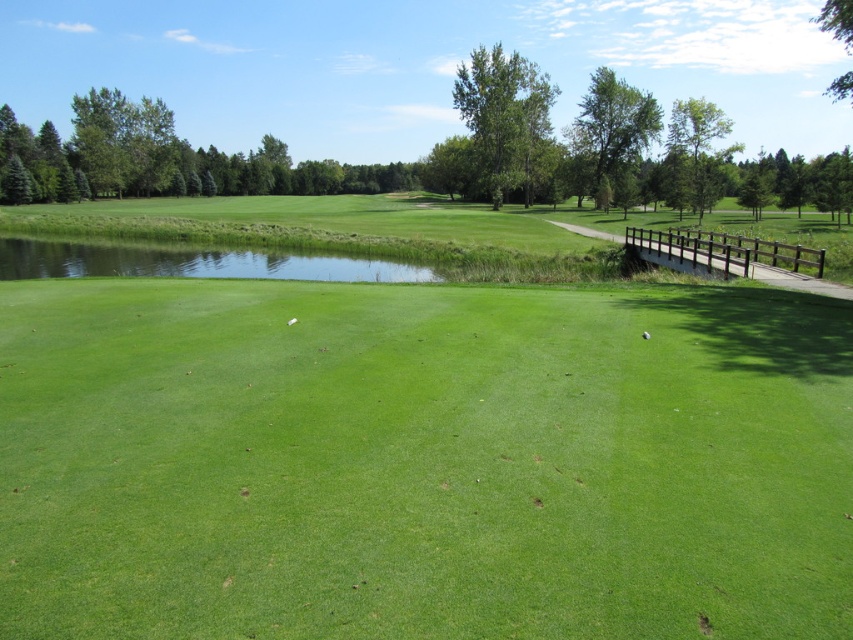
Looking at this image, you are a golfer who just hit a ball from the green grassy golf course at center. Your ball is now on the clear water at center. How far did your ball travel?

The distance between the green grassy golf course at center and the clear water at center is 64.25 feet, so the ball traveled 64.25 feet.

You are a golfer standing on the tee box and want to hit your ball to the green grassy golf course at center. However, there is a clear water at center in your path. Based on the scene, which area takes up more space in the image?

The clear water at center occupies more space than the green grassy golf course at center according to the description.

From the picture: You are a golfer standing at the tee and see two points on the golf course, namely point [219,253] and point [648,337]. Which point is closer to your current position?

Point [219,253] is further to the camera than point [648,337], so the point closer to your current position is point [648,337].